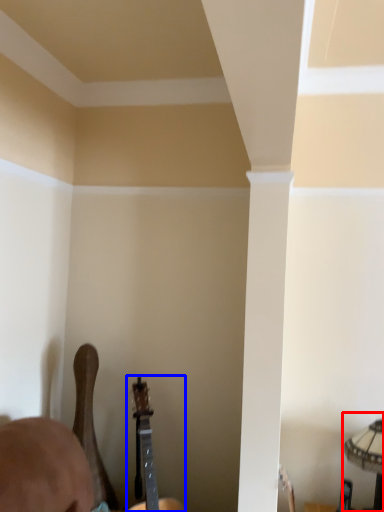
Question: Which object appears closest to the camera in this image, lamp (highlighted by a red box) or guitar (highlighted by a blue box)?

Choices:
 (A) lamp
 (B) guitar

Answer: (A)